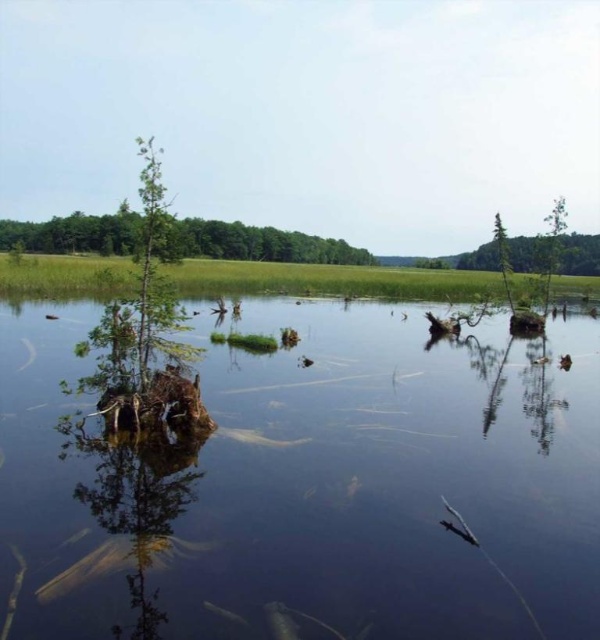
Is translucent greenish fish at center closer to camera compared to translucent clear fish at lower center?

No, it is behind translucent clear fish at lower center.

Who is taller, translucent greenish fish at center or translucent clear fish at lower center?

With more height is translucent greenish fish at center.

Is point (238, 436) closer to viewer compared to point (214, 608)?

No, it is behind (214, 608).

This screenshot has height=640, width=600. Identify the location of translucent greenish fish at center. (258, 436).

Does green matte tree at upper center have a greater width compared to translucent clear fish at lower center?

Correct, the width of green matte tree at upper center exceeds that of translucent clear fish at lower center.

Is point (189, 246) more distant than point (229, 620)?

Yes, point (189, 246) is farther from viewer.

The width and height of the screenshot is (600, 640). Find the location of `green matte tree at upper center`. green matte tree at upper center is located at coordinates (259, 243).

Between clear water at center and green matte tree at upper center, which one has more height?

green matte tree at upper center is taller.

Measure the distance from clear water at center to green matte tree at upper center.

clear water at center is 37.31 meters from green matte tree at upper center.

The height and width of the screenshot is (640, 600). I want to click on clear water at center, so click(307, 484).

You are a GUI agent. You are given a task and a screenshot of the screen. Output one action in this format:
    pyautogui.click(x=<x>, y=<y>)
    Task: Click on the clear water at center
    
    Given the screenshot: What is the action you would take?
    pos(307,484)